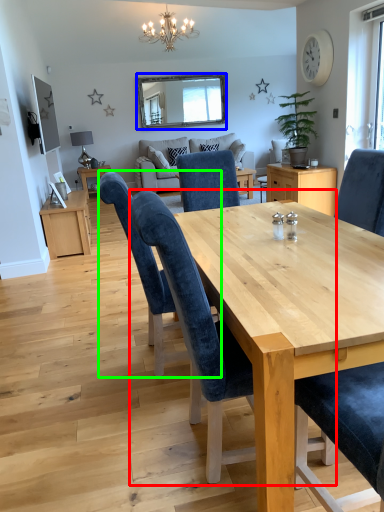
Question: Considering the real-world distances, which object is farthest from chair (highlighted by a red box)? mirror (highlighted by a blue box) or chair (highlighted by a green box)?

Choices:
 (A) mirror
 (B) chair

Answer: (A)